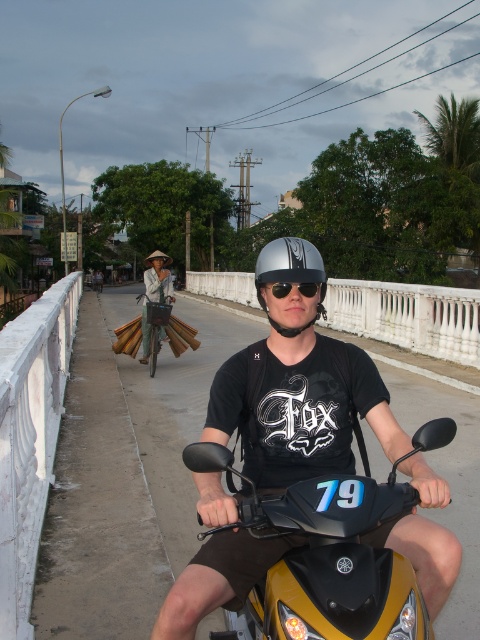
Question: Is the position of matte black helmet at center more distant than that of silver metallic helmet at center?

Choices:
 (A) yes
 (B) no

Answer: (B)

Question: Which object is closer to the camera taking this photo?

Choices:
 (A) yellow matte motorcycle at center
 (B) sunglasses at center

Answer: (A)

Question: In this image, where is silver metallic helmet at center located relative to sunglasses at center?

Choices:
 (A) right
 (B) left

Answer: (A)

Question: Which point appears farthest from the camera in this image?

Choices:
 (A) pos(197,600)
 (B) pos(257,600)
 (C) pos(312,256)
 (D) pos(165,337)

Answer: (D)

Question: Which point appears closest to the camera in this image?

Choices:
 (A) (290, 276)
 (B) (346, 442)
 (C) (144, 353)

Answer: (A)

Question: Can you confirm if matte black helmet at center is thinner than sunglasses at center?

Choices:
 (A) no
 (B) yes

Answer: (A)